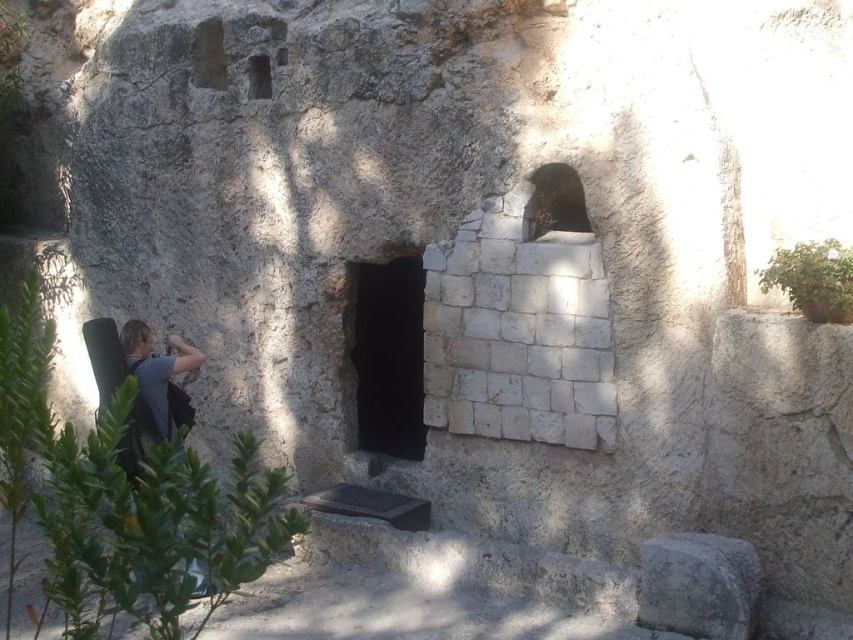
You are an archaeologist examining the ancient stone structure. You notice the gray rough stone at lower right and the gray fabric at left. Which object is positioned lower in the scene?

The gray rough stone at lower right is located below the gray fabric at left, so it is positioned lower in the scene.